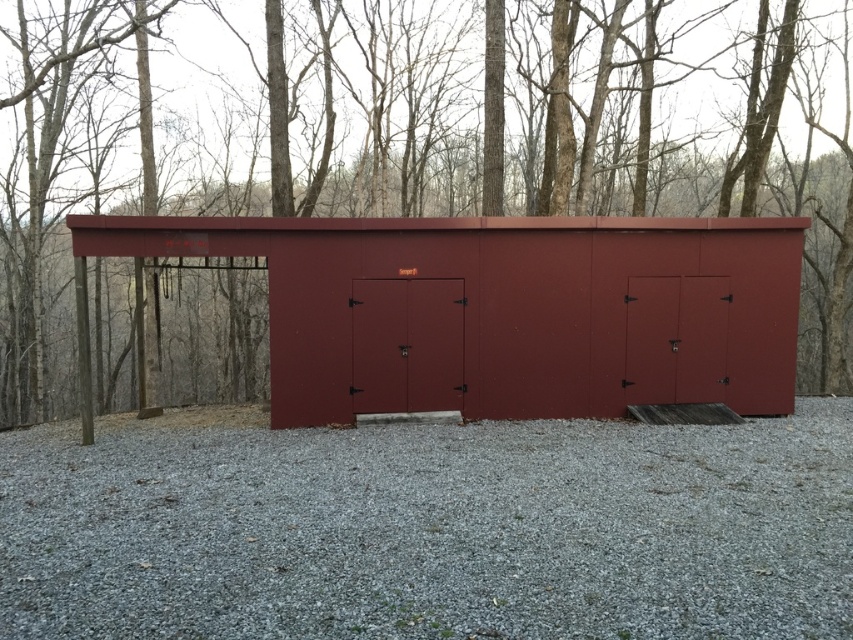
In order to click on smooth bark tree at center in this screenshot , I will do `click(448, 209)`.

Who is shorter, smooth bark tree at center or gray gravel at center?

gray gravel at center

Image resolution: width=853 pixels, height=640 pixels. Describe the element at coordinates (448, 209) in the screenshot. I see `smooth bark tree at center` at that location.

What are the coordinates of `smooth bark tree at center` in the screenshot? It's located at (448, 209).

Which is behind, point (558, 474) or point (746, 269)?

The point (746, 269) is behind.

Locate an element on the screen. This screenshot has height=640, width=853. gray gravel at center is located at coordinates (428, 529).

This screenshot has height=640, width=853. I want to click on gray gravel at center, so click(x=428, y=529).

This screenshot has width=853, height=640. I want to click on smooth bark tree at center, so click(448, 209).

Between point (851, 250) and point (558, 403), which one is positioned in front?

Point (558, 403) is in front.

This screenshot has height=640, width=853. Identify the location of smooth bark tree at center. (448, 209).